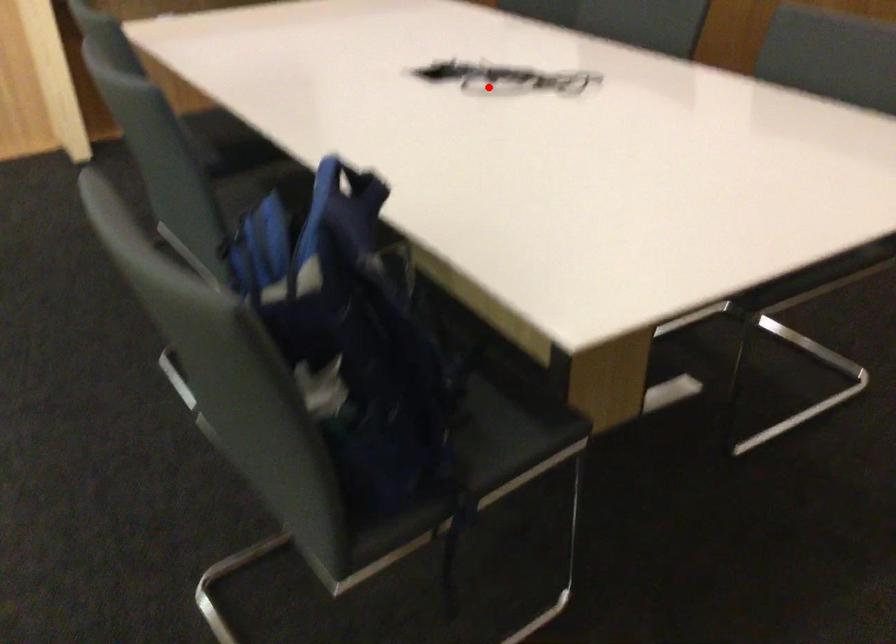
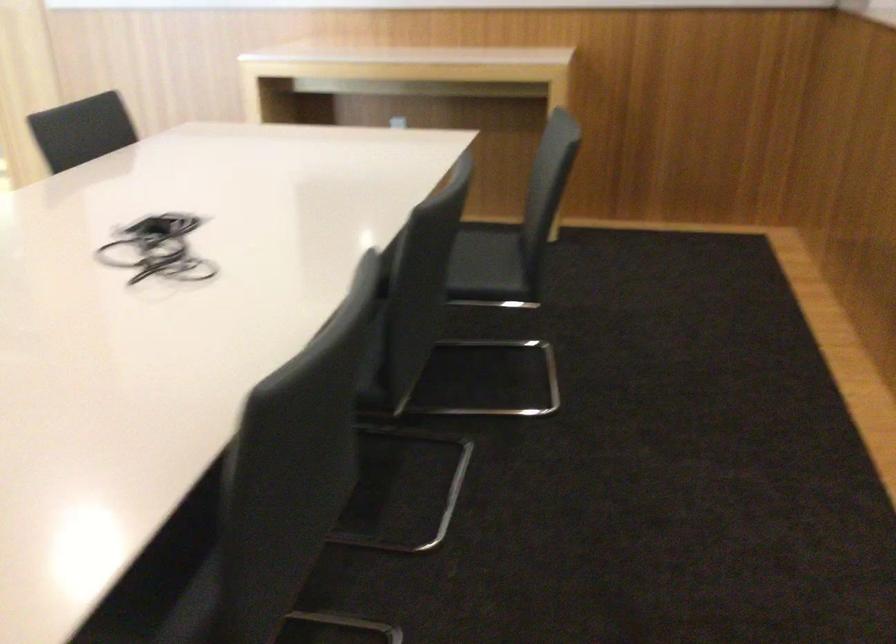
Locate, in the second image, the point that corresponds to the highlighted location in the first image.

(158, 249)